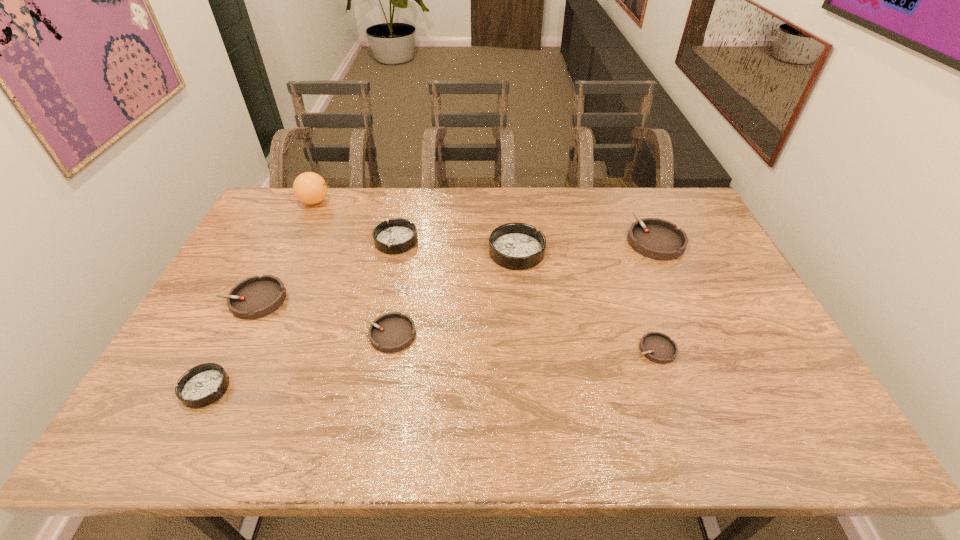
The image size is (960, 540). I want to click on the sixth closest object relative to the smallest gray ashtray, so click(202, 385).

You are a GUI agent. You are given a task and a screenshot of the screen. Output one action in this format:
    pyautogui.click(x=<x>, y=<y>)
    Task: Click on the object that is the fifth closest one to the farthest gray ashtray
    
    Given the screenshot: What is the action you would take?
    pyautogui.click(x=310, y=188)

Identify which ashtray is the third closest to the second biggest gray ashtray. Please provide its 2D coordinates. Your answer should be formatted as a tuple, i.e. [(x, y)], where the tuple contains the x and y coordinates of a point satisfying the conditions above.

[(393, 332)]

Find the location of `ashtray that is the fourth closest to the farthest gray ashtray`. ashtray that is the fourth closest to the farthest gray ashtray is located at coordinates (393, 332).

The height and width of the screenshot is (540, 960). In order to click on the third closest gray ashtray to the farthest gray ashtray in this screenshot , I will do `click(255, 297)`.

Identify which gray ashtray is the third closest to the farthest object. Please provide its 2D coordinates. Your answer should be formatted as a tuple, i.e. [(x, y)], where the tuple contains the x and y coordinates of a point satisfying the conditions above.

[(654, 238)]

The width and height of the screenshot is (960, 540). Find the location of `dark ashtray that is the closest to the nearest dark ashtray`. dark ashtray that is the closest to the nearest dark ashtray is located at coordinates (398, 235).

Select which dark ashtray appears as the closest to the farthest object. Please provide its 2D coordinates. Your answer should be formatted as a tuple, i.e. [(x, y)], where the tuple contains the x and y coordinates of a point satisfying the conditions above.

[(398, 235)]

You are a GUI agent. You are given a task and a screenshot of the screen. Output one action in this format:
    pyautogui.click(x=<x>, y=<y>)
    Task: Click on the blank area in the image that satisfies the following two spatial constraints: 1. on the side with brand of the farthest gray ashtray; 2. on the right side of the ping-pong ball
    This screenshot has width=960, height=540.
    Given the screenshot: What is the action you would take?
    pyautogui.click(x=297, y=240)

Locate an element on the screen. vacant area that satisfies the following two spatial constraints: 1. on the side with brand of the tallest object; 2. on the left side of the fifth ashtray from left to right is located at coordinates coord(291,252).